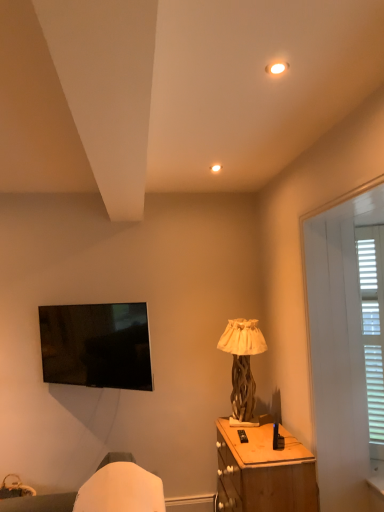
Question: Should I look upward or downward to see white wooden blinds at right?

Choices:
 (A) up
 (B) down

Answer: (B)

Question: Can you confirm if wooden textured lamp at center is positioned to the left of wooden nightstand at lower right?

Choices:
 (A) no
 (B) yes

Answer: (B)

Question: Can you confirm if wooden textured lamp at center is smaller than wooden nightstand at lower right?

Choices:
 (A) yes
 (B) no

Answer: (A)

Question: Could you tell me if wooden textured lamp at center is turned towards wooden nightstand at lower right?

Choices:
 (A) no
 (B) yes

Answer: (A)

Question: Are wooden textured lamp at center and wooden nightstand at lower right making contact?

Choices:
 (A) no
 (B) yes

Answer: (A)

Question: Is the position of wooden textured lamp at center more distant than that of wooden nightstand at lower right?

Choices:
 (A) yes
 (B) no

Answer: (A)

Question: Considering the relative sizes of wooden textured lamp at center and wooden nightstand at lower right in the image provided, is wooden textured lamp at center bigger than wooden nightstand at lower right?

Choices:
 (A) yes
 (B) no

Answer: (B)

Question: Are white wooden blinds at right and wooden textured lamp at center beside each other?

Choices:
 (A) yes
 (B) no

Answer: (B)

Question: Is white wooden blinds at right to the right of wooden textured lamp at center from the viewer's perspective?

Choices:
 (A) yes
 (B) no

Answer: (A)

Question: Could you tell me if white wooden blinds at right is turned towards wooden textured lamp at center?

Choices:
 (A) yes
 (B) no

Answer: (B)

Question: Is white wooden blinds at right positioned before wooden textured lamp at center?

Choices:
 (A) no
 (B) yes

Answer: (B)

Question: Is white wooden blinds at right outside wooden textured lamp at center?

Choices:
 (A) yes
 (B) no

Answer: (A)

Question: Can you confirm if white wooden blinds at right is thinner than wooden textured lamp at center?

Choices:
 (A) yes
 (B) no

Answer: (A)

Question: From a real-world perspective, is wooden textured lamp at center under matte white light fixture at upper center?

Choices:
 (A) no
 (B) yes

Answer: (B)